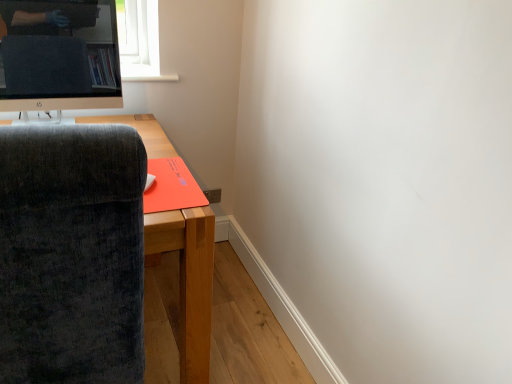
Question: From the image's perspective, is velvet dark gray chair at left over satin black monitor at upper left?

Choices:
 (A) no
 (B) yes

Answer: (A)

Question: Does velvet dark gray chair at left have a greater height compared to satin black monitor at upper left?

Choices:
 (A) no
 (B) yes

Answer: (B)

Question: Does velvet dark gray chair at left have a larger size compared to satin black monitor at upper left?

Choices:
 (A) yes
 (B) no

Answer: (A)

Question: Is velvet dark gray chair at left touching satin black monitor at upper left?

Choices:
 (A) yes
 (B) no

Answer: (B)

Question: Is velvet dark gray chair at left closer to the viewer compared to satin black monitor at upper left?

Choices:
 (A) yes
 (B) no

Answer: (A)

Question: From a real-world perspective, relative to dark gray fabric chair at left, is satin black monitor at upper left vertically above or below?

Choices:
 (A) below
 (B) above

Answer: (B)

Question: Looking at the image, does satin black monitor at upper left seem bigger or smaller compared to dark gray fabric chair at left?

Choices:
 (A) big
 (B) small

Answer: (B)

Question: Is satin black monitor at upper left inside or outside of dark gray fabric chair at left?

Choices:
 (A) outside
 (B) inside

Answer: (A)

Question: Would you say satin black monitor at upper left is to the left or to the right of dark gray fabric chair at left in the picture?

Choices:
 (A) right
 (B) left

Answer: (B)

Question: Would you say orange matte mousepad at lower left is to the left or to the right of velvet dark gray chair at left in the picture?

Choices:
 (A) left
 (B) right

Answer: (B)

Question: From a real-world perspective, is orange matte mousepad at lower left positioned above or below velvet dark gray chair at left?

Choices:
 (A) below
 (B) above

Answer: (B)

Question: From the image's perspective, is orange matte mousepad at lower left located above or below velvet dark gray chair at left?

Choices:
 (A) above
 (B) below

Answer: (A)

Question: In terms of height, does orange matte mousepad at lower left look taller or shorter compared to velvet dark gray chair at left?

Choices:
 (A) tall
 (B) short

Answer: (B)

Question: From a real-world perspective, is velvet dark gray chair at left positioned above or below satin black monitor at upper left?

Choices:
 (A) above
 (B) below

Answer: (B)

Question: From their relative heights in the image, would you say velvet dark gray chair at left is taller or shorter than satin black monitor at upper left?

Choices:
 (A) tall
 (B) short

Answer: (A)